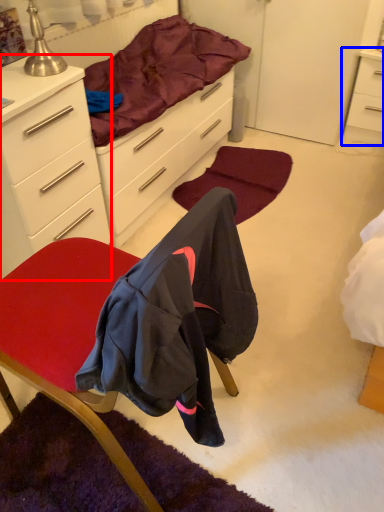
Question: Among these objects, which one is nearest to the camera, cabinetry (highlighted by a red box) or nightstand (highlighted by a blue box)?

Choices:
 (A) cabinetry
 (B) nightstand

Answer: (A)